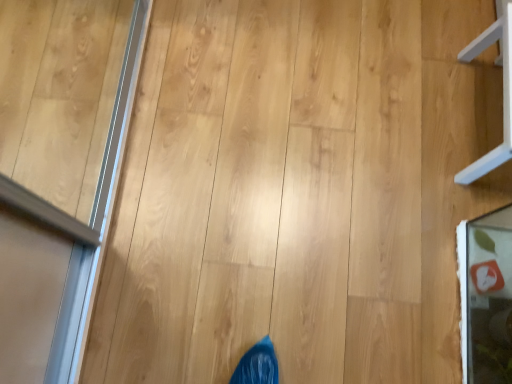
Where is `white matte chair at right`? white matte chair at right is located at coordinates click(503, 90).

Describe the element at coordinates (503, 90) in the screenshot. The height and width of the screenshot is (384, 512). I see `white matte chair at right` at that location.

Where is `white matte chair at right`? white matte chair at right is located at coordinates (503, 90).